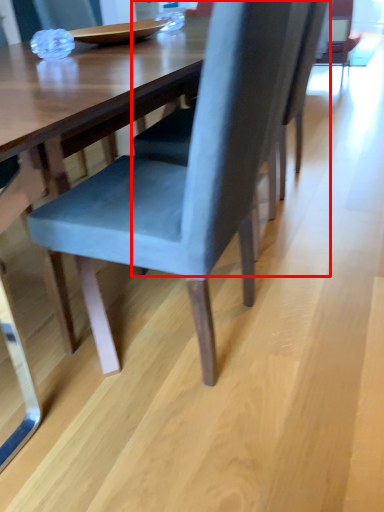
Question: From the image's perspective, where is chair (annotated by the red box) located in relation to chair in the image?

Choices:
 (A) above
 (B) below

Answer: (A)